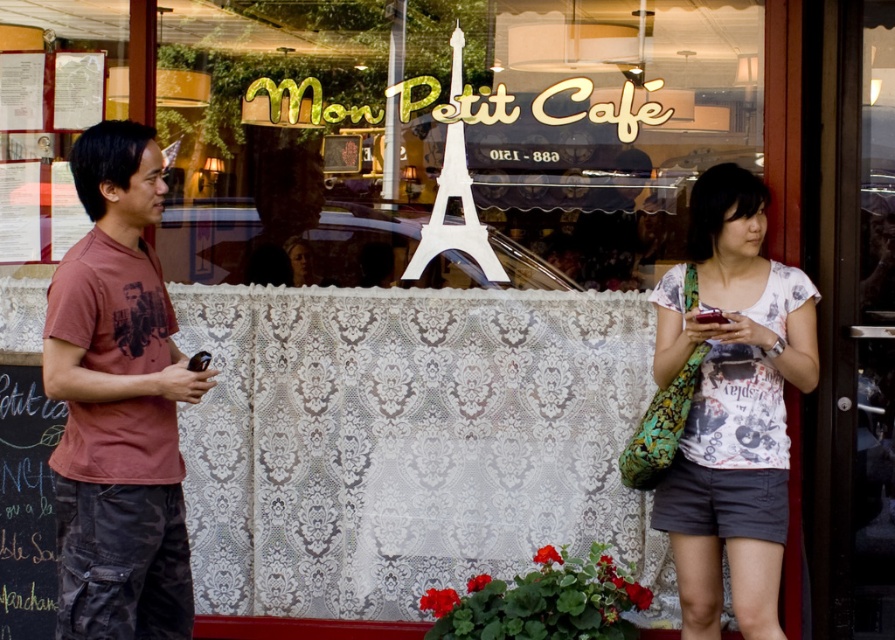
Question: Is white printed shirt at center to the left of black chalkboard at left from the viewer's perspective?

Choices:
 (A) yes
 (B) no

Answer: (B)

Question: Can you confirm if matte red t-shirt at left is positioned to the right of black chalkboard at left?

Choices:
 (A) no
 (B) yes

Answer: (B)

Question: Can you confirm if white printed shirt at center is positioned below white plastic eiffel tower at center?

Choices:
 (A) no
 (B) yes

Answer: (B)

Question: Which object is positioned farthest from the white plastic eiffel tower at center?

Choices:
 (A) white printed shirt at center
 (B) matte red t-shirt at left
 (C) black chalkboard at left

Answer: (C)

Question: Which object is closer to the camera taking this photo?

Choices:
 (A) white printed shirt at center
 (B) white plastic eiffel tower at center
 (C) black chalkboard at left
 (D) matte red t-shirt at left

Answer: (D)

Question: Which of the following is the closest to the observer?

Choices:
 (A) (7, 368)
 (B) (722, 468)

Answer: (B)